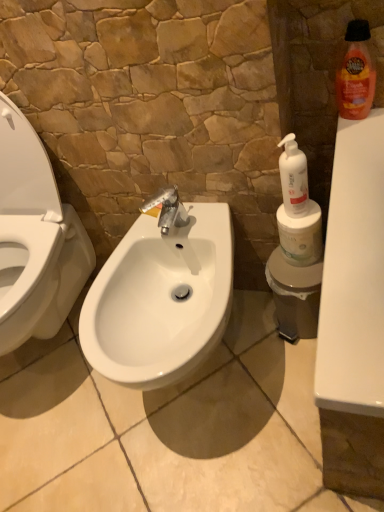
Question: Should I look upward or downward to see white glossy bidet at center?

Choices:
 (A) up
 (B) down

Answer: (B)

Question: Is white glossy sink at center completely or partially outside of orange glossy bottle at upper right, acting as the first cleaning product starting from the right?

Choices:
 (A) no
 (B) yes

Answer: (B)

Question: Is white glossy sink at center in front of orange glossy bottle at upper right, acting as the first cleaning product starting from the right?

Choices:
 (A) no
 (B) yes

Answer: (B)

Question: Is orange glossy bottle at upper right, acting as the first cleaning product starting from the right, inside white glossy sink at center?

Choices:
 (A) no
 (B) yes

Answer: (A)

Question: Does white glossy sink at center have a larger size compared to orange glossy bottle at upper right, the 1th cleaning product when ordered from top to bottom?

Choices:
 (A) no
 (B) yes

Answer: (B)

Question: Is white glossy sink at center shorter than orange glossy bottle at upper right, the 1th cleaning product when ordered from top to bottom?

Choices:
 (A) no
 (B) yes

Answer: (A)

Question: Considering the relative positions of white glossy sink at center and orange glossy bottle at upper right, the 2th cleaning product from the bottom, in the image provided, is white glossy sink at center behind orange glossy bottle at upper right, the 2th cleaning product from the bottom,?

Choices:
 (A) yes
 (B) no

Answer: (B)

Question: Is white plastic pump bottle at right, arranged as the second cleaning product when viewed from the right, not close to white glossy bidet at center?

Choices:
 (A) no
 (B) yes

Answer: (A)

Question: Considering the relative positions of white plastic pump bottle at right, marked as the second cleaning product in a top-to-bottom arrangement, and white glossy bidet at center in the image provided, is white plastic pump bottle at right, marked as the second cleaning product in a top-to-bottom arrangement, to the right of white glossy bidet at center from the viewer's perspective?

Choices:
 (A) no
 (B) yes

Answer: (B)

Question: Is white plastic pump bottle at right, acting as the 1th cleaning product starting from the left, taller than white glossy bidet at center?

Choices:
 (A) no
 (B) yes

Answer: (A)

Question: Considering the relative sizes of white plastic pump bottle at right, marked as the second cleaning product in a top-to-bottom arrangement, and white glossy bidet at center in the image provided, is white plastic pump bottle at right, marked as the second cleaning product in a top-to-bottom arrangement, bigger than white glossy bidet at center?

Choices:
 (A) yes
 (B) no

Answer: (B)

Question: Can you confirm if white plastic pump bottle at right, arranged as the second cleaning product when viewed from the right, is thinner than white glossy bidet at center?

Choices:
 (A) yes
 (B) no

Answer: (A)

Question: Is white plastic pump bottle at right, marked as the second cleaning product in a top-to-bottom arrangement, outside white glossy bidet at center?

Choices:
 (A) no
 (B) yes

Answer: (B)

Question: Can you confirm if white matte toilet paper at right is thinner than white plastic pump bottle at right, arranged as the second cleaning product when viewed from the right?

Choices:
 (A) yes
 (B) no

Answer: (B)